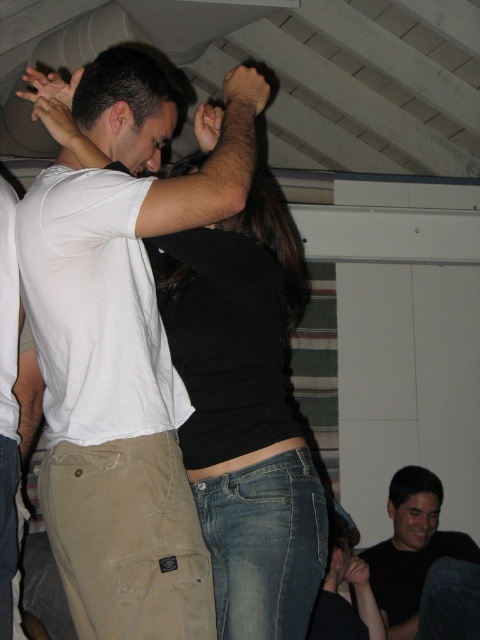
Question: Is white cotton t-shirt at center wider than white matte t-shirt at center?

Choices:
 (A) yes
 (B) no

Answer: (A)

Question: Where is white cotton t-shirt at center located in relation to black matte shirt at center in the image?

Choices:
 (A) left
 (B) right

Answer: (A)

Question: In this image, where is white matte t-shirt at center located relative to black matte shirt at lower right?

Choices:
 (A) left
 (B) right

Answer: (A)

Question: Which point appears closest to the camera in this image?

Choices:
 (A) (265, 582)
 (B) (72, 420)

Answer: (A)

Question: Which object is farther from the camera taking this photo?

Choices:
 (A) white matte t-shirt at center
 (B) black matte shirt at lower right

Answer: (B)

Question: Which of the following is the farthest from the observer?

Choices:
 (A) (165, 356)
 (B) (254, 253)

Answer: (B)